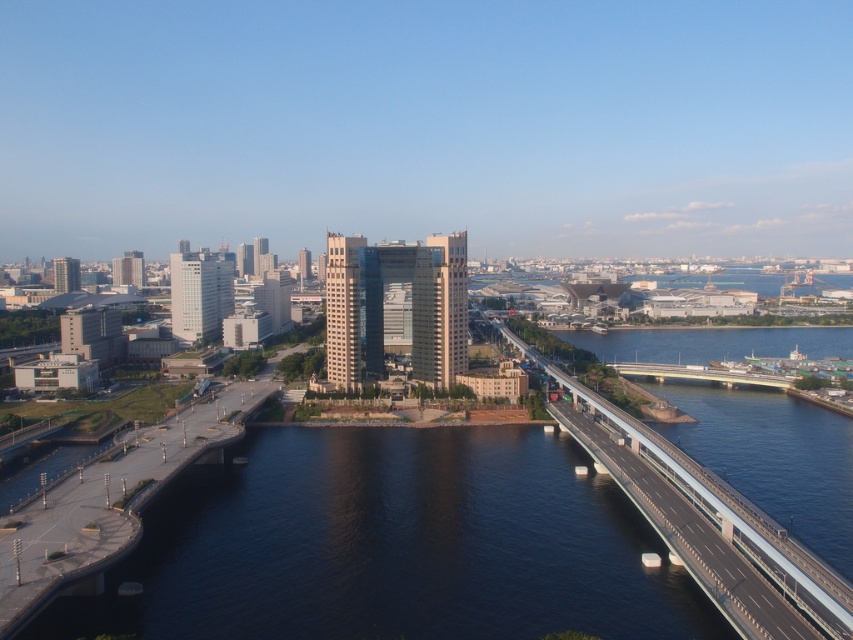
Who is lower down, concrete bridge at right or concrete bridge at center?

Positioned lower is concrete bridge at right.

Does concrete bridge at right have a smaller size compared to concrete bridge at center?

Incorrect, concrete bridge at right is not smaller in size than concrete bridge at center.

I want to click on concrete bridge at right, so click(705, 522).

You are a GUI agent. You are given a task and a screenshot of the screen. Output one action in this format:
    pyautogui.click(x=<x>, y=<y>)
    Task: Click on the concrete bridge at right
    The width and height of the screenshot is (853, 640).
    Given the screenshot: What is the action you would take?
    pyautogui.click(x=705, y=522)